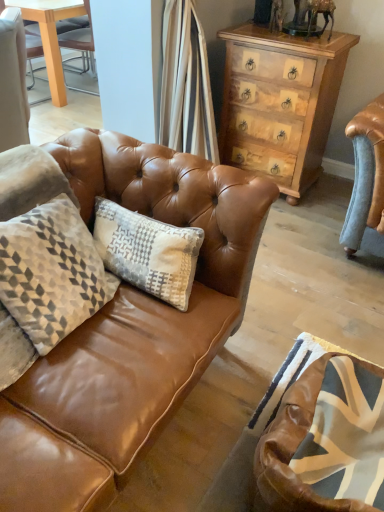
Question: Considering the relative sizes of light brown wood chest of drawers at upper right and brown leather swivel chair at lower right in the image provided, is light brown wood chest of drawers at upper right wider than brown leather swivel chair at lower right?

Choices:
 (A) no
 (B) yes

Answer: (B)

Question: Considering the relative positions of light brown wood chest of drawers at upper right and brown leather swivel chair at lower right in the image provided, is light brown wood chest of drawers at upper right to the left of brown leather swivel chair at lower right from the viewer's perspective?

Choices:
 (A) no
 (B) yes

Answer: (A)

Question: Is light brown wood chest of drawers at upper right shorter than brown leather swivel chair at lower right?

Choices:
 (A) no
 (B) yes

Answer: (A)

Question: From a real-world perspective, is light brown wood chest of drawers at upper right located beneath brown leather swivel chair at lower right?

Choices:
 (A) yes
 (B) no

Answer: (B)

Question: From a real-world perspective, is light brown wood chest of drawers at upper right located higher than brown leather swivel chair at lower right?

Choices:
 (A) no
 (B) yes

Answer: (B)

Question: Does light brown wood chest of drawers at upper right have a larger size compared to brown leather swivel chair at lower right?

Choices:
 (A) no
 (B) yes

Answer: (B)

Question: Is brown leather swivel chair at lower right oriented away from light brown wood chest of drawers at upper right?

Choices:
 (A) no
 (B) yes

Answer: (A)

Question: From a real-world perspective, is brown leather swivel chair at lower right physically above light brown wood chest of drawers at upper right?

Choices:
 (A) no
 (B) yes

Answer: (A)

Question: From the image's perspective, is brown leather swivel chair at lower right above light brown wood chest of drawers at upper right?

Choices:
 (A) no
 (B) yes

Answer: (A)

Question: Would you consider brown leather swivel chair at lower right to be distant from light brown wood chest of drawers at upper right?

Choices:
 (A) no
 (B) yes

Answer: (B)

Question: Considering the relative sizes of brown leather swivel chair at lower right and light brown wood chest of drawers at upper right in the image provided, is brown leather swivel chair at lower right shorter than light brown wood chest of drawers at upper right?

Choices:
 (A) no
 (B) yes

Answer: (B)

Question: Can you confirm if brown leather swivel chair at lower right is wider than light brown wood chest of drawers at upper right?

Choices:
 (A) no
 (B) yes

Answer: (A)

Question: From a real-world perspective, is brown leather swivel chair at lower right located beneath matte brown leather couch at center?

Choices:
 (A) no
 (B) yes

Answer: (A)